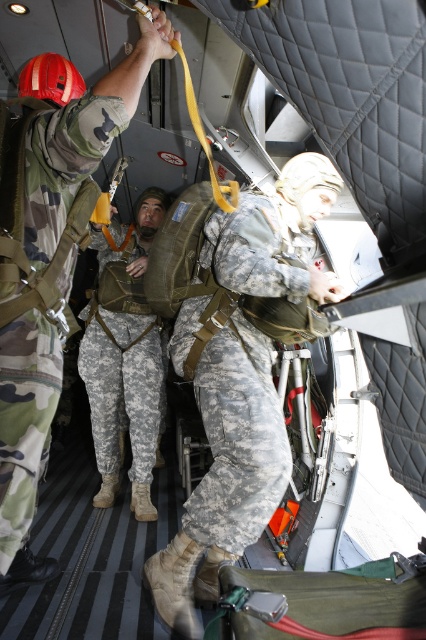
Can you confirm if camouflage fabric uniform at center is positioned below camouflage fabric pants at center?

Indeed, camouflage fabric uniform at center is positioned under camouflage fabric pants at center.

Can you confirm if camouflage fabric uniform at center is smaller than camouflage fabric pants at center?

Actually, camouflage fabric uniform at center might be larger than camouflage fabric pants at center.

You are a GUI agent. You are given a task and a screenshot of the screen. Output one action in this format:
    pyautogui.click(x=<x>, y=<y>)
    Task: Click on the camouflage fabric uniform at center
    The width and height of the screenshot is (426, 640).
    Given the screenshot: What is the action you would take?
    pyautogui.click(x=236, y=362)

Is camouflage fabric uniform at center shorter than camouflage uniform at center?

Incorrect, camouflage fabric uniform at center's height does not fall short of camouflage uniform at center's.

Is camouflage fabric uniform at center taller than camouflage uniform at center?

Indeed, camouflage fabric uniform at center has a greater height compared to camouflage uniform at center.

Describe the element at coordinates (236, 362) in the screenshot. I see `camouflage fabric uniform at center` at that location.

Find the location of a particular element. This screenshot has width=426, height=640. camouflage fabric uniform at center is located at coordinates (236, 362).

Does camouflage uniform at center appear on the left side of camouflage fabric pants at center?

No, camouflage uniform at center is not to the left of camouflage fabric pants at center.

Does point (34, 216) come farther from viewer compared to point (103, 440)?

No, it is in front of (103, 440).

At what (x,y) coordinates should I click in order to perform the action: click on camouflage uniform at center. Please return your answer as a coordinate pair (x, y). Looking at the image, I should click on (52, 280).